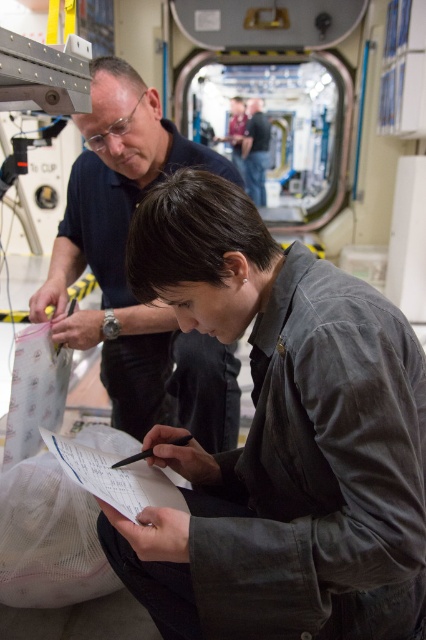
You are an astronaut on a space station and need to hand a document to your colleague. You see the white paper at center and the dark blue shirt at center. Which object should you approach first to reach the document?

The white paper at center is closer to the viewer than the dark blue shirt at center, so you should approach the white paper at center first to reach the document.

You are navigating a space station and need to move from point A to point B. Point A is at coordinates point(92, 161) and point B is at point(256, 198). According to the scene, which point is closer to you?

Point(92, 161) is in front of point(256, 198), so point A is closer to you.

You are an astronaut on the space station and need to locate the emergency manual. You see the dark gray uniform at center and the dark blue shirt at upper left. Which one is positioned lower in the scene?

The dark gray uniform at center is below dark blue shirt at upper left, so the dark gray uniform at center is positioned lower in the scene.